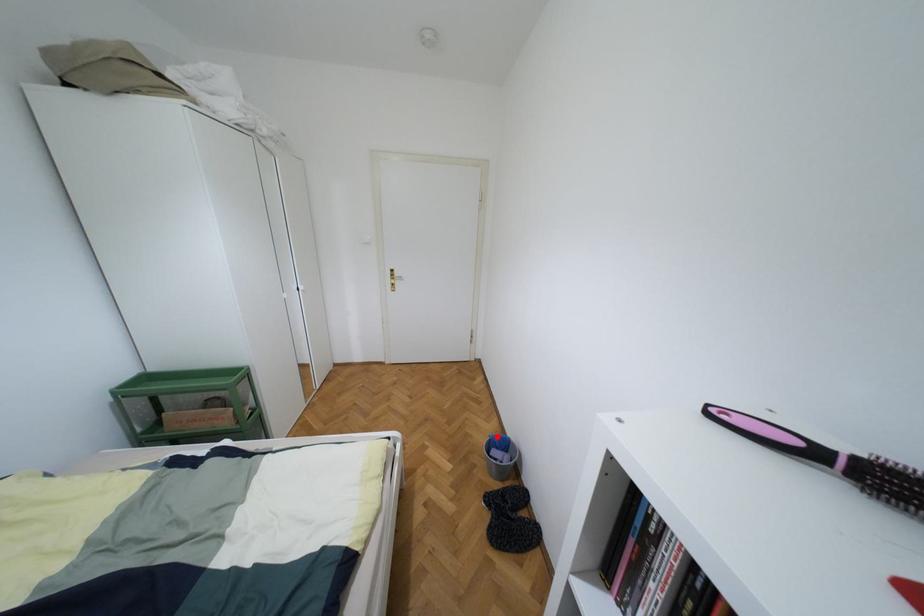
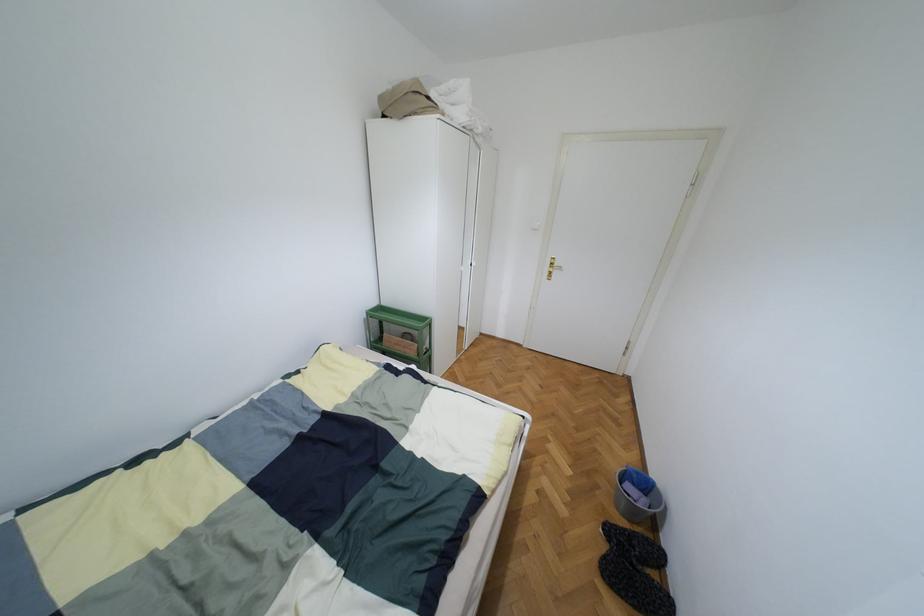
Question: A red point is marked in image1. In image2, is the corresponding 3D point closer to the camera or farther? Reply with the corresponding letter.

Choices:
 (A) The corresponding 3D point is closer.
 (B) The corresponding 3D point is farther.

Answer: (B)